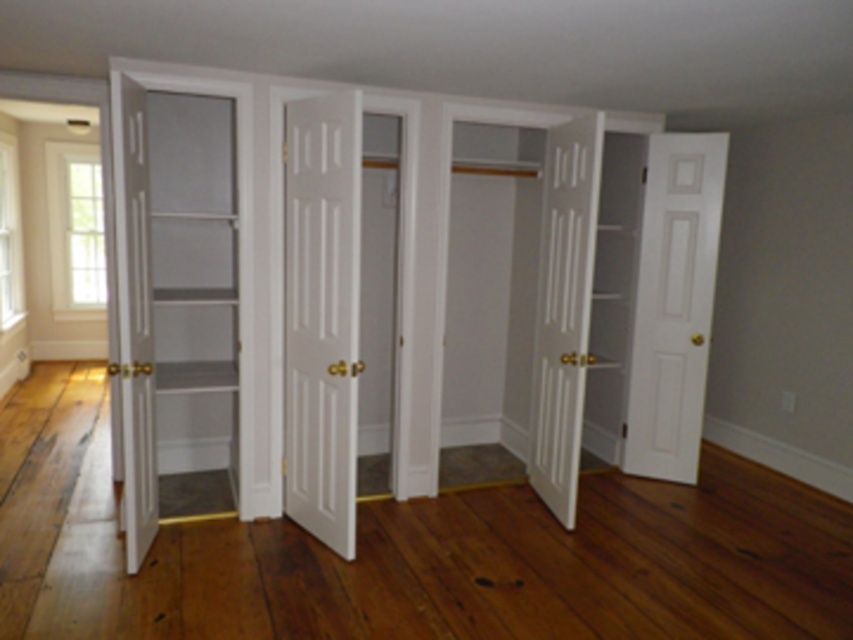
Between white matte door at right and white glossy door at left, which one appears on the left side from the viewer's perspective?

white glossy door at left is more to the left.

Does white matte door at right have a lesser width compared to white glossy door at left?

No, white matte door at right is not thinner than white glossy door at left.

At what (x,y) coordinates should I click in order to perform the action: click on white matte door at right. Please return your answer as a coordinate pair (x, y). Looking at the image, I should click on (672, 305).

Which of these two, white matte closet doors at center or white matte door at right, stands shorter?

white matte door at right is shorter.

Is white matte closet doors at center taller than white matte door at right?

Yes.

Between point (694, 294) and point (668, 323), which one is positioned behind?

The point (668, 323) is behind.

Locate an element on the screen. white matte closet doors at center is located at coordinates (445, 292).

Describe the element at coordinates (445, 292) in the screenshot. The height and width of the screenshot is (640, 853). I see `white matte closet doors at center` at that location.

Is white matte closet doors at center shorter than white glossy door at left?

In fact, white matte closet doors at center may be taller than white glossy door at left.

Between point (579, 136) and point (137, 301), which one is positioned in front?

Point (137, 301) is in front.

Find the location of a particular element. Image resolution: width=853 pixels, height=640 pixels. white matte closet doors at center is located at coordinates (445, 292).